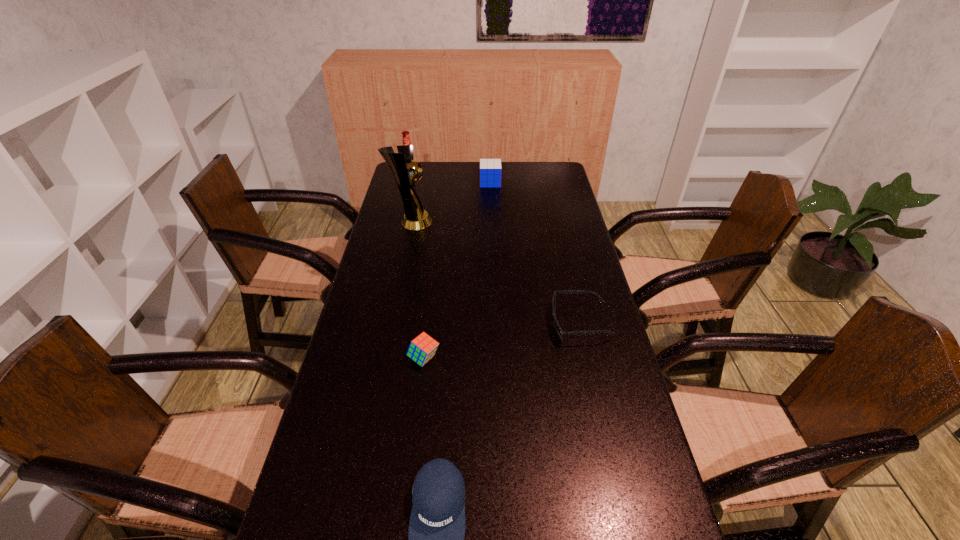
Image resolution: width=960 pixels, height=540 pixels. Identify the location of object that is at the right edge. (560, 332).

Locate an element on the screen. The image size is (960, 540). object located in the far left corner section of the desktop is located at coordinates (406, 140).

Find the location of a particular element. This screenshot has width=960, height=540. free point at the far edge is located at coordinates (443, 161).

The image size is (960, 540). What are the coordinates of `vacant space at the left edge` in the screenshot? It's located at (343, 434).

Image resolution: width=960 pixels, height=540 pixels. What are the coordinates of `free region at the right edge of the desktop` in the screenshot? It's located at (613, 334).

Image resolution: width=960 pixels, height=540 pixels. In the image, there is a desktop. In order to click on vacant space at the far left corner in this screenshot , I will do `click(417, 187)`.

You are a GUI agent. You are given a task and a screenshot of the screen. Output one action in this format:
    pyautogui.click(x=<x>, y=<y>)
    Task: Click on the unoccupied area between the third nearest object and the farther cube
    
    Given the screenshot: What is the action you would take?
    pyautogui.click(x=535, y=253)

Where is `free point between the shortest object and the fifth farthest object`? free point between the shortest object and the fifth farthest object is located at coordinates (501, 341).

The height and width of the screenshot is (540, 960). I want to click on free area in between the root beer and the rightmost object, so click(x=495, y=252).

In order to click on free space that is in between the shortest object and the second nearest object in this screenshot , I will do `click(501, 341)`.